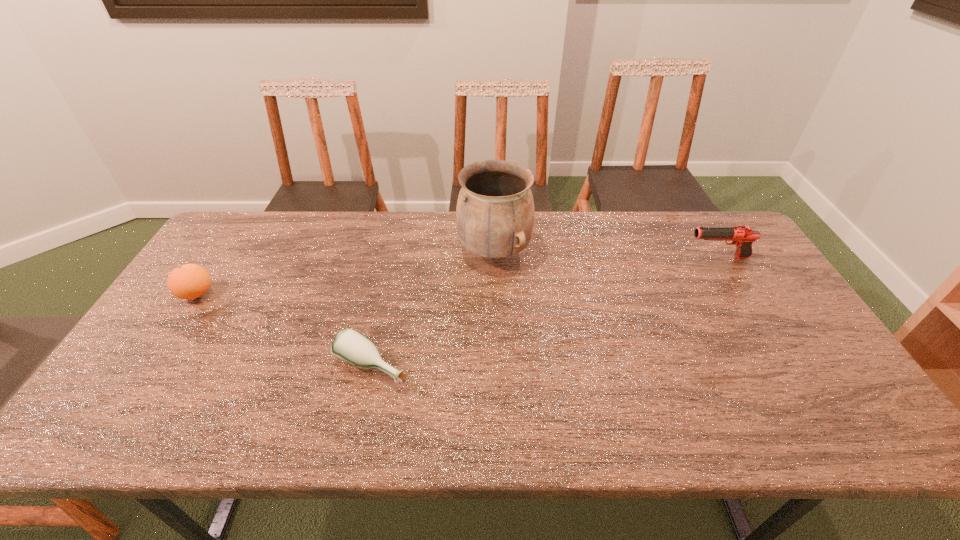
I want to click on vacant space that satisfies the following two spatial constraints: 1. at the aiming end of the rightmost object; 2. on the front side of the bottle, so click(x=783, y=366).